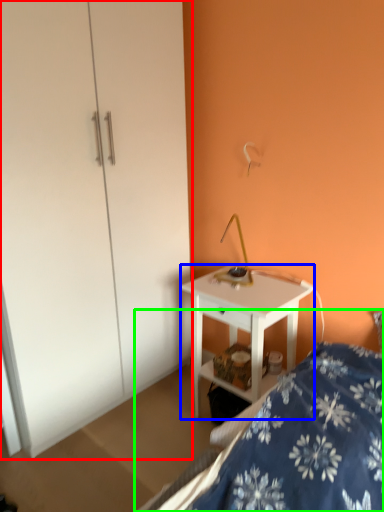
Question: Which is farther away from dresser (highlighted by a red box)? desk (highlighted by a blue box) or bed (highlighted by a green box)?

Choices:
 (A) desk
 (B) bed

Answer: (B)